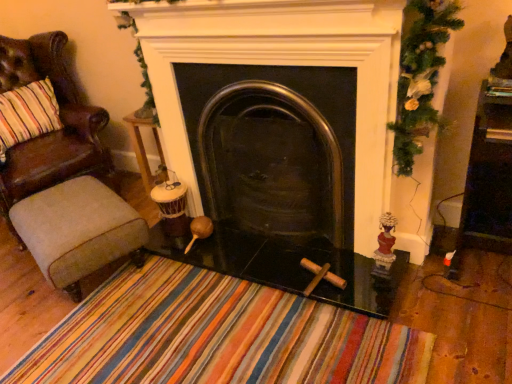
Find the location of `vacant space situated above transparent glass table at center (from a real-world perspective)`. vacant space situated above transparent glass table at center (from a real-world perspective) is located at coordinates (274, 233).